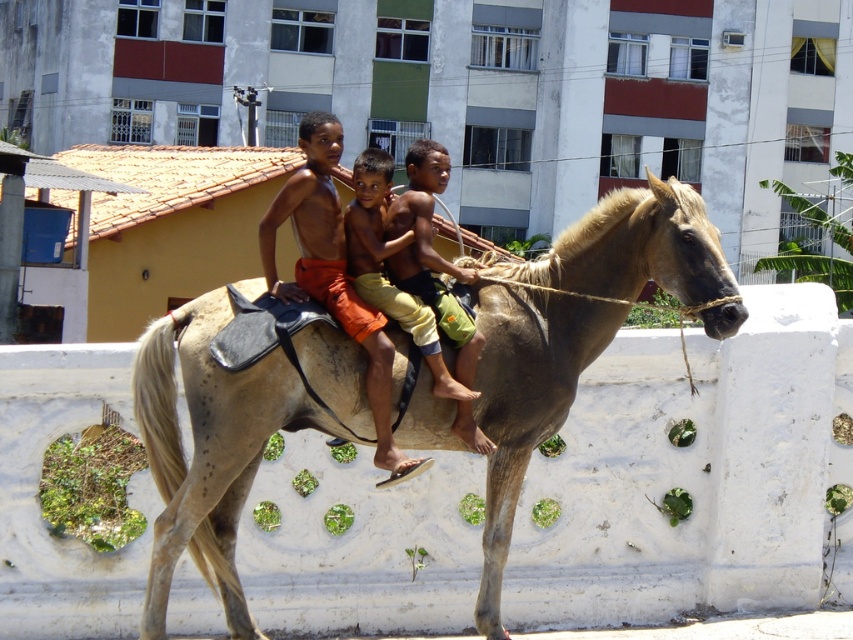
Question: Is light brown skin at center wider than tan skin boy at center?

Choices:
 (A) yes
 (B) no

Answer: (A)

Question: Can you confirm if light brown skin at center is positioned above tan skin boy at center?

Choices:
 (A) no
 (B) yes

Answer: (A)

Question: Which of these objects is positioned farthest from the light brown leather horse at center?

Choices:
 (A) light brown skin at center
 (B) tan skin boy at center

Answer: (B)

Question: Which is nearer to the light brown skin at center?

Choices:
 (A) tan skin boy at center
 (B) light brown leather horse at center

Answer: (A)

Question: Can you confirm if light brown leather horse at center is positioned to the right of tan skin boy at center?

Choices:
 (A) no
 (B) yes

Answer: (B)

Question: Which object is farther from the camera taking this photo?

Choices:
 (A) light brown skin at center
 (B) light brown leather horse at center
 (C) tan skin boy at center

Answer: (C)